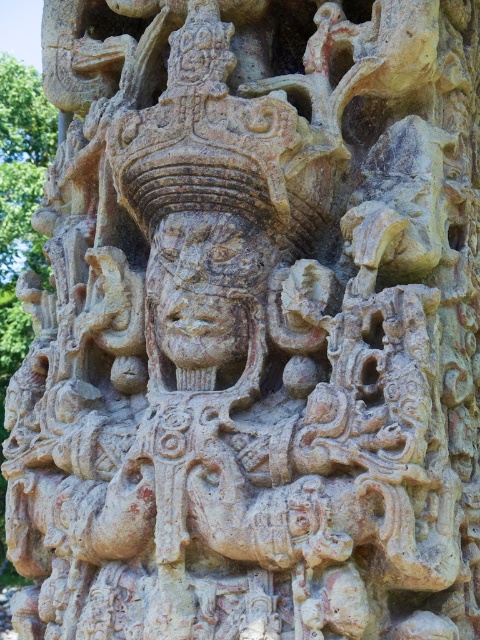
You are an archaeologist examining the stone relief. You notice the carved stone face at center and the green stone tree at left. Based on their positions, which object is closer to the viewer?

The carved stone face at center is closer to the viewer because it is positioned in front of the green stone tree at left.

You are an archaeologist examining the stone relief. You need to determine which object is larger between the carved stone face at center and the green stone tree at left. Based on the relief, which one is bigger?

The carved stone face at center is smaller than the green stone tree at left, so the green stone tree at left is larger.

What are the coordinates of the carved stone face at center?

The carved stone face at center is located at coordinates point (205,285).